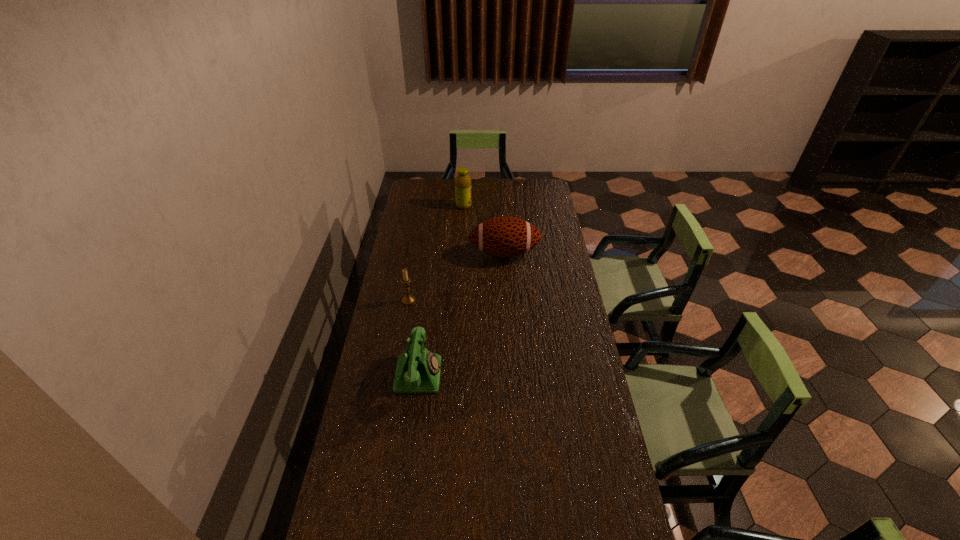
Point out which object is positioned as the second nearest to the farthest object. Please provide its 2D coordinates. Your answer should be formatted as a tuple, i.e. [(x, y)], where the tuple contains the x and y coordinates of a point satisfying the conditions above.

[(408, 299)]

The width and height of the screenshot is (960, 540). Identify the location of vacant space that satisfies the following two spatial constraints: 1. on the front label of the third nearest object; 2. on the right side of the farthest object. (461, 253).

I want to click on vacant space that satisfies the following two spatial constraints: 1. on the back side of the candle holder; 2. on the right side of the football, so click(417, 253).

Find the location of `free region that satisfies the following two spatial constraints: 1. on the front label of the farthest object; 2. on the front side of the second nearest object`. free region that satisfies the following two spatial constraints: 1. on the front label of the farthest object; 2. on the front side of the second nearest object is located at coordinates [x=459, y=300].